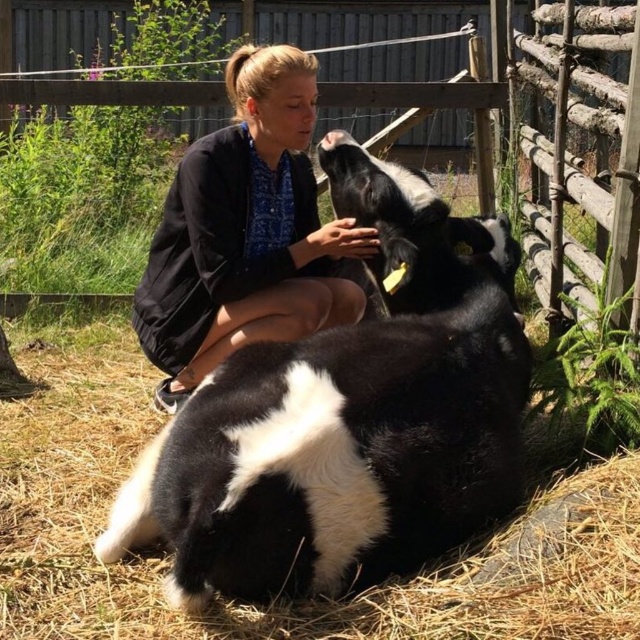
You are a photographer standing in the scene. You want to take a photo of the black cotton shorts at center and the wooden fence at upper center. Which object should you focus on first if you want the one that is taller to be in focus?

The black cotton shorts at center is taller than the wooden fence at upper center, so you should focus on the black cotton shorts at center first to ensure it is in focus.

You are a photographer standing in the scene and want to capture the black cotton shorts at center and the wooden fence at upper center in the same frame. Which object will appear larger in the photo?

The black cotton shorts at center will appear larger in the photo because it is closer to the viewer than the wooden fence at upper center.